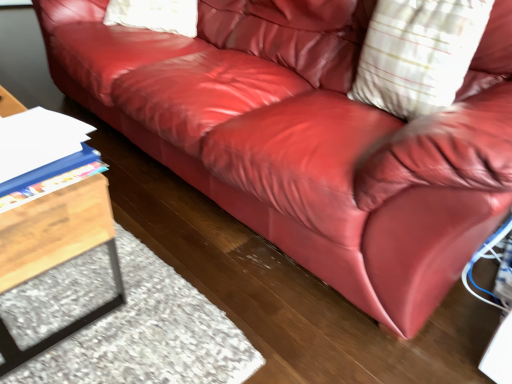
Question: Is blue plastic folder at lower left outside of wooden table at left?

Choices:
 (A) no
 (B) yes

Answer: (B)

Question: Is wooden table at left at the back of blue plastic folder at lower left?

Choices:
 (A) no
 (B) yes

Answer: (A)

Question: Is blue plastic folder at lower left to the right of wooden table at left from the viewer's perspective?

Choices:
 (A) yes
 (B) no

Answer: (A)

Question: From a real-world perspective, is blue plastic folder at lower left positioned under wooden table at left based on gravity?

Choices:
 (A) no
 (B) yes

Answer: (A)

Question: Can you confirm if blue plastic folder at lower left is bigger than wooden table at left?

Choices:
 (A) yes
 (B) no

Answer: (B)

Question: From the image's perspective, is blue plastic folder at lower left beneath wooden table at left?

Choices:
 (A) no
 (B) yes

Answer: (A)

Question: Could you tell me if wooden table at left is facing blue plastic folder at lower left?

Choices:
 (A) no
 (B) yes

Answer: (A)

Question: Is blue plastic folder at lower left a part of wooden table at left?

Choices:
 (A) no
 (B) yes

Answer: (A)

Question: Is wooden table at left with blue plastic folder at lower left?

Choices:
 (A) yes
 (B) no

Answer: (B)

Question: From the image's perspective, is wooden table at left above blue plastic folder at lower left?

Choices:
 (A) yes
 (B) no

Answer: (B)

Question: Is wooden table at left taller than blue plastic folder at lower left?

Choices:
 (A) yes
 (B) no

Answer: (A)

Question: From a real-world perspective, is wooden table at left on top of blue plastic folder at lower left?

Choices:
 (A) yes
 (B) no

Answer: (B)

Question: Could you tell me if white striped pillow at upper right is turned towards blue plastic folder at lower left?

Choices:
 (A) no
 (B) yes

Answer: (B)